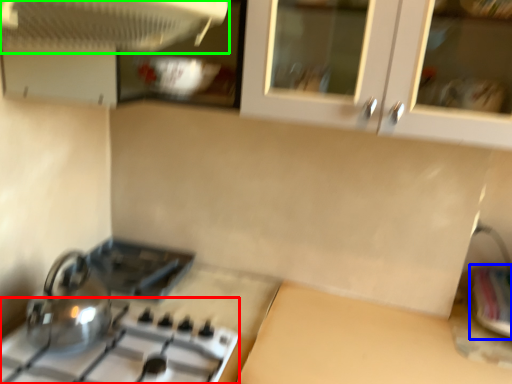
Question: Which is farther away from gas stove (highlighted by a red box)? sink (highlighted by a blue box) or kitchen appliance (highlighted by a green box)?

Choices:
 (A) sink
 (B) kitchen appliance

Answer: (A)